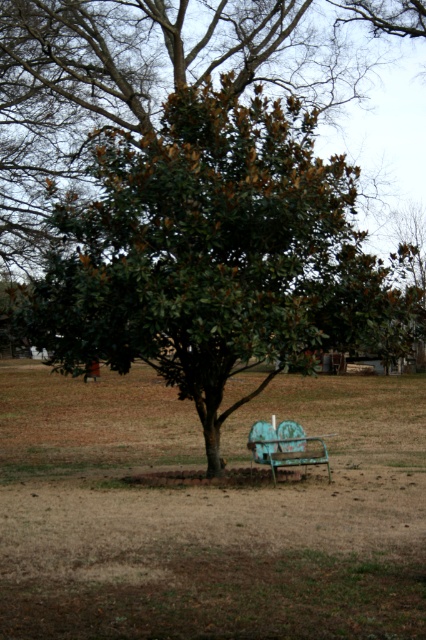
Question: Does brown dry grass at center lie in front of teal painted metal bench at lower center?

Choices:
 (A) no
 (B) yes

Answer: (B)

Question: Which of the following is the closest to the observer?

Choices:
 (A) brown dry grass at center
 (B) green leafy tree at center

Answer: (A)

Question: Which object is the farthest from the teal painted metal bench at lower center?

Choices:
 (A) brown dry grass at center
 (B) green leafy tree at center

Answer: (A)

Question: Among these points, which one is nearest to the camera?

Choices:
 (A) (143, 433)
 (B) (210, 362)

Answer: (B)

Question: Is brown dry grass at center wider than teal painted metal bench at lower center?

Choices:
 (A) no
 (B) yes

Answer: (B)

Question: Does green leafy tree at center appear under teal painted metal bench at lower center?

Choices:
 (A) no
 (B) yes

Answer: (A)